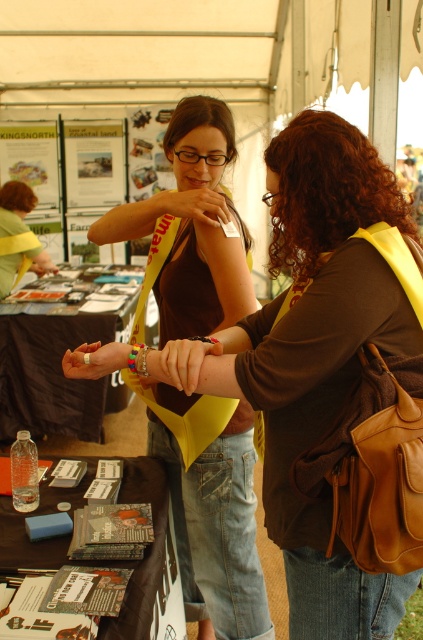
Who is lower down, brown matte vest at center or matte yellow vest at center?

brown matte vest at center is lower down.

Does brown matte vest at center have a larger size compared to matte yellow vest at center?

Indeed, brown matte vest at center has a larger size compared to matte yellow vest at center.

You are a GUI agent. You are given a task and a screenshot of the screen. Output one action in this format:
    pyautogui.click(x=<x>, y=<y>)
    Task: Click on the brown matte vest at center
    The image size is (423, 640).
    Given the screenshot: What is the action you would take?
    pyautogui.click(x=326, y=362)

Who is positioned more to the right, yellow fabric sash at center or brown leather purse at center?

brown leather purse at center

Does yellow fabric sash at center have a larger size compared to brown leather purse at center?

Yes, yellow fabric sash at center is bigger than brown leather purse at center.

Locate an element on the screen. Image resolution: width=423 pixels, height=640 pixels. yellow fabric sash at center is located at coordinates (192, 227).

You are a GUI agent. You are given a task and a screenshot of the screen. Output one action in this format:
    pyautogui.click(x=<x>, y=<y>)
    Task: Click on the yellow fabric sash at center
    The image size is (423, 640).
    Given the screenshot: What is the action you would take?
    pyautogui.click(x=192, y=227)

Between brown leather purse at center and matte yellow vest at center, which one appears on the right side from the viewer's perspective?

From the viewer's perspective, brown leather purse at center appears more on the right side.

Is point (307, 266) positioned after point (35, 237)?

No.

You are a GUI agent. You are given a task and a screenshot of the screen. Output one action in this format:
    pyautogui.click(x=<x>, y=<y>)
    Task: Click on the brown leather purse at center
    The width and height of the screenshot is (423, 640).
    Given the screenshot: What is the action you would take?
    pyautogui.click(x=326, y=189)